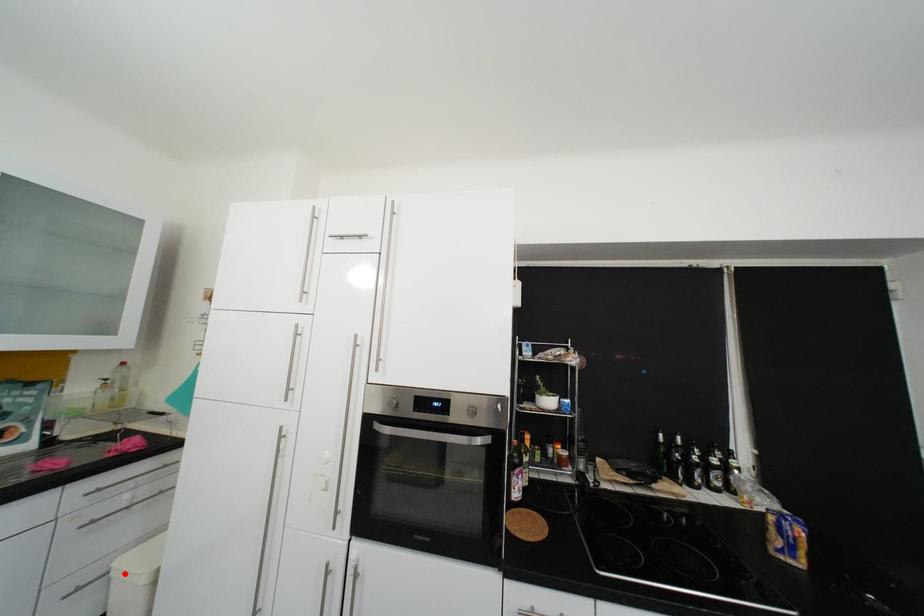
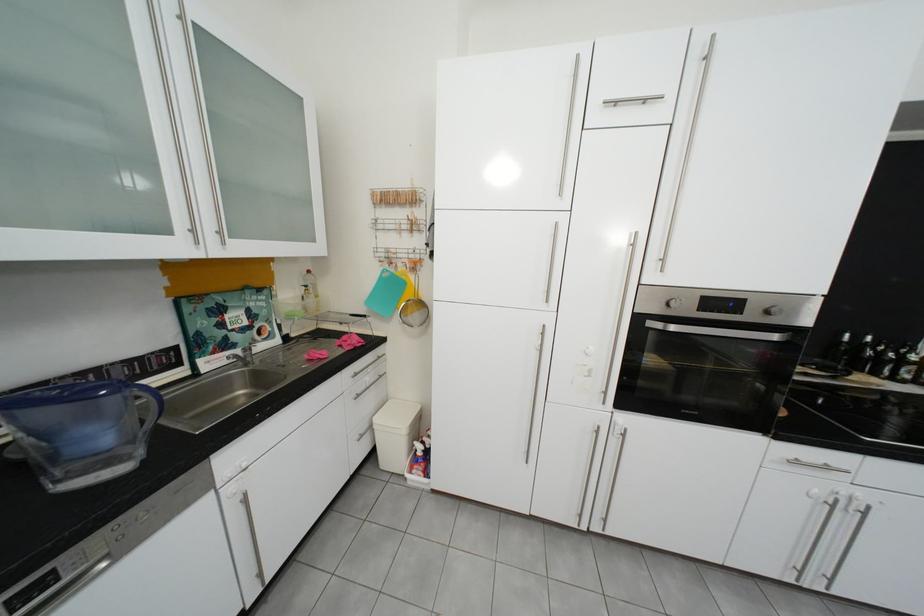
Question: I am providing you with two images of the same scene from different viewpoints. Given a red point in image1, look at the same physical point in image2. Is it:

Choices:
 (A) Closer to the viewpoint
 (B) Farther from the viewpoint

Answer: (B)